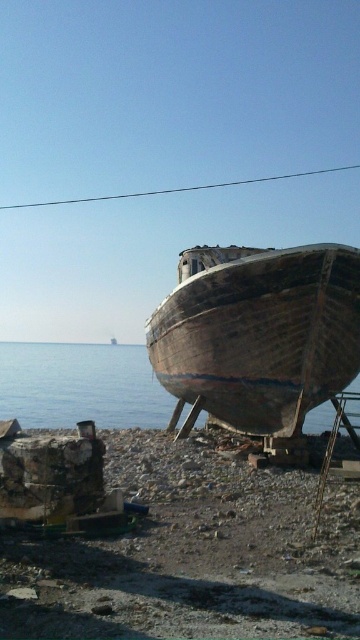
Is weathered wood boat at center closer to the viewer compared to blue wooden boat at center?

No, it is not.

Looking at this image, does weathered wood boat at center have a larger size compared to blue wooden boat at center?

No, weathered wood boat at center is not bigger than blue wooden boat at center.

Is point (192, 326) positioned before point (65, 420)?

Yes, point (192, 326) is in front of point (65, 420).

You are a GUI agent. You are given a task and a screenshot of the screen. Output one action in this format:
    pyautogui.click(x=<x>, y=<y>)
    Task: Click on the weathered wood boat at center
    The width and height of the screenshot is (360, 640).
    Given the screenshot: What is the action you would take?
    pyautogui.click(x=258, y=333)

Who is positioned more to the right, rusty metallic boat at lower right or blue wooden boat at center?

rusty metallic boat at lower right

Who is higher up, rusty metallic boat at lower right or blue wooden boat at center?

Positioned higher is blue wooden boat at center.

Locate an element on the screen. This screenshot has height=640, width=360. rusty metallic boat at lower right is located at coordinates (194, 554).

Locate an element on the screen. The height and width of the screenshot is (640, 360). rusty metallic boat at lower right is located at coordinates (194, 554).

Is rusty metallic boat at lower right further to the viewer compared to weathered wood boat at center?

No.

Does rusty metallic boat at lower right appear on the right side of weathered wood boat at center?

In fact, rusty metallic boat at lower right is to the left of weathered wood boat at center.

Does point (277, 609) come closer to viewer compared to point (299, 282)?

Yes, it is.

I want to click on rusty metallic boat at lower right, so pyautogui.click(x=194, y=554).